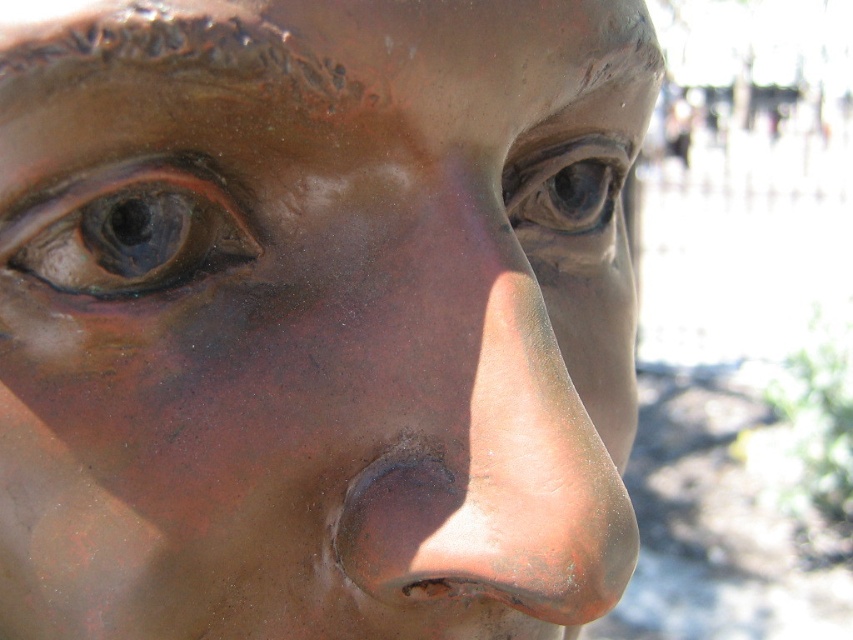
Image resolution: width=853 pixels, height=640 pixels. Describe the element at coordinates (498, 449) in the screenshot. I see `bronze textured nose at center` at that location.

Is point (407, 506) farther from camera compared to point (178, 276)?

No, (407, 506) is closer to viewer.

Which is in front, point (567, 556) or point (177, 186)?

Positioned in front is point (567, 556).

This screenshot has height=640, width=853. Identify the location of bronze textured nose at center. (498, 449).

Who is shorter, shiny bronze eye at upper left or matte bronze eye at center?

shiny bronze eye at upper left is shorter.

Who is positioned more to the right, shiny bronze eye at upper left or matte bronze eye at center?

Positioned to the right is matte bronze eye at center.

Is point (119, 186) positioned after point (561, 209)?

No, (119, 186) is closer to viewer.

This screenshot has width=853, height=640. Find the location of `shiny bronze eye at upper left`. shiny bronze eye at upper left is located at coordinates (128, 228).

Can you confirm if bronze textured nose at center is positioned to the left of matte bronze eye at center?

Indeed, bronze textured nose at center is positioned on the left side of matte bronze eye at center.

Locate an element on the screen. bronze textured nose at center is located at coordinates (498, 449).

You are a GUI agent. You are given a task and a screenshot of the screen. Output one action in this format:
    pyautogui.click(x=<x>, y=<y>)
    Task: Click on the bronze textured nose at center
    The width and height of the screenshot is (853, 640).
    Given the screenshot: What is the action you would take?
    pyautogui.click(x=498, y=449)